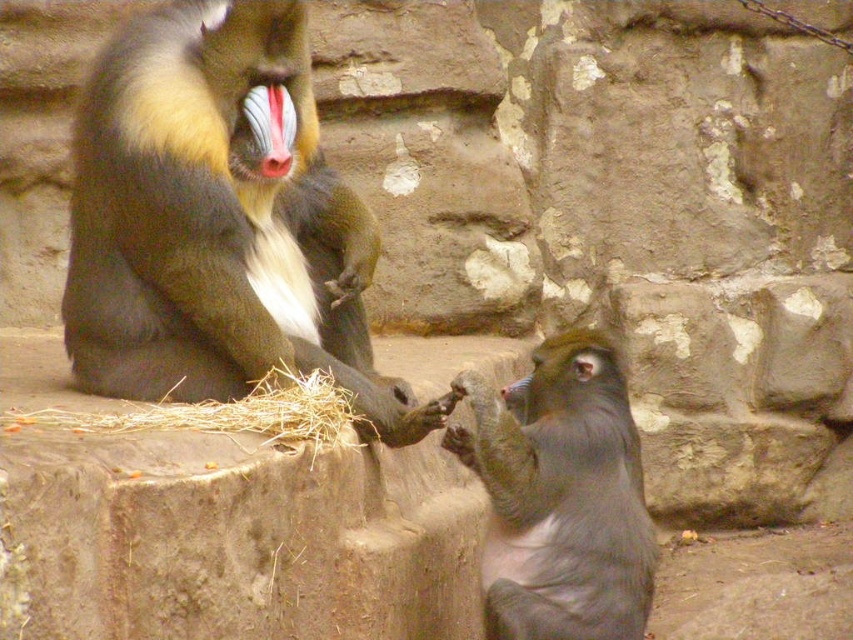
Question: Is shiny fur monkey at upper left thinner than gray furry monkey at center?

Choices:
 (A) yes
 (B) no

Answer: (B)

Question: Can you confirm if shiny fur monkey at upper left is thinner than gray furry monkey at center?

Choices:
 (A) yes
 (B) no

Answer: (B)

Question: Which object appears closest to the camera in this image?

Choices:
 (A) gray furry monkey at center
 (B) shiny fur monkey at upper left

Answer: (A)

Question: Does shiny fur monkey at upper left have a smaller size compared to gray furry monkey at center?

Choices:
 (A) yes
 (B) no

Answer: (B)

Question: Which object appears farthest from the camera in this image?

Choices:
 (A) gray furry monkey at center
 (B) shiny fur monkey at upper left

Answer: (B)